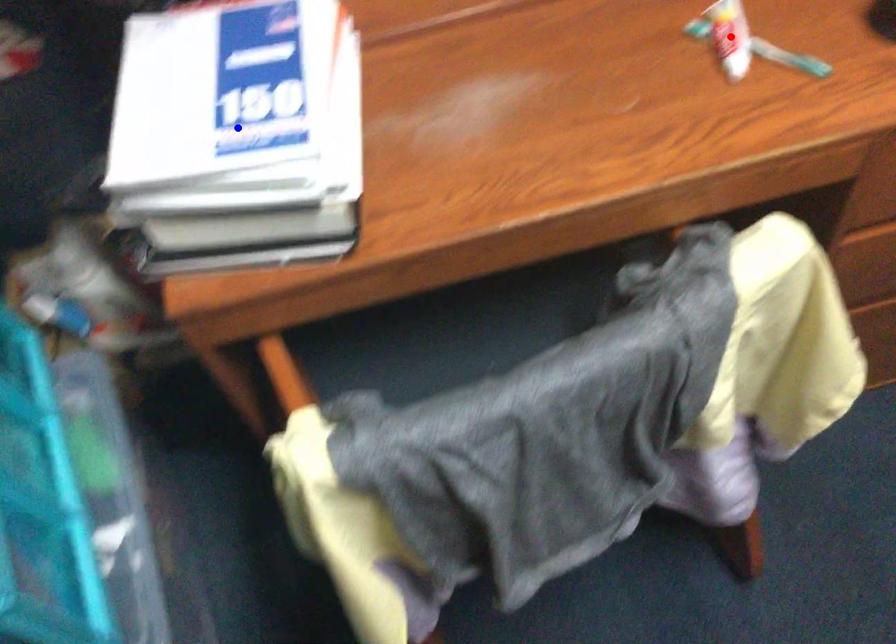
Question: Which of the two points in the image is closer to the camera?

Choices:
 (A) Blue point is closer.
 (B) Red point is closer.

Answer: (A)